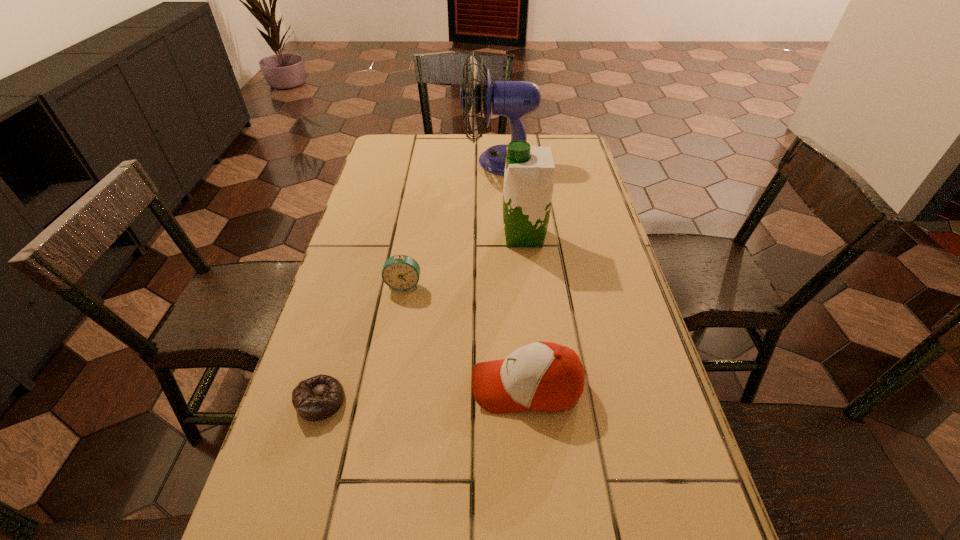
This screenshot has width=960, height=540. I want to click on vacant space located in front of the farthest object where the airflow is directed, so click(429, 161).

This screenshot has height=540, width=960. Identify the location of vacant space located 0.250m in front of the farthest object where the airflow is directed. (392, 161).

I want to click on free region located on the front-facing side of the second tallest object, so click(x=375, y=237).

Where is `blank space located 0.300m on the front-facing side of the second tallest object`? blank space located 0.300m on the front-facing side of the second tallest object is located at coordinates (396, 237).

Locate an element on the screen. free space located on the front-facing side of the second tallest object is located at coordinates (383, 237).

Where is `vacant area located 0.220m on the front-facing side of the baseball cap`? vacant area located 0.220m on the front-facing side of the baseball cap is located at coordinates (365, 387).

Locate an element on the screen. This screenshot has height=540, width=960. vacant region located on the front-facing side of the baseball cap is located at coordinates (389, 387).

I want to click on free space located on the front-facing side of the baseball cap, so click(x=423, y=387).

The width and height of the screenshot is (960, 540). Identify the location of free space located 0.310m on the front-facing side of the third nearest object. (383, 404).

Find the location of a particular element. The image size is (960, 540). free space located on the back of the leftmost object is located at coordinates (332, 360).